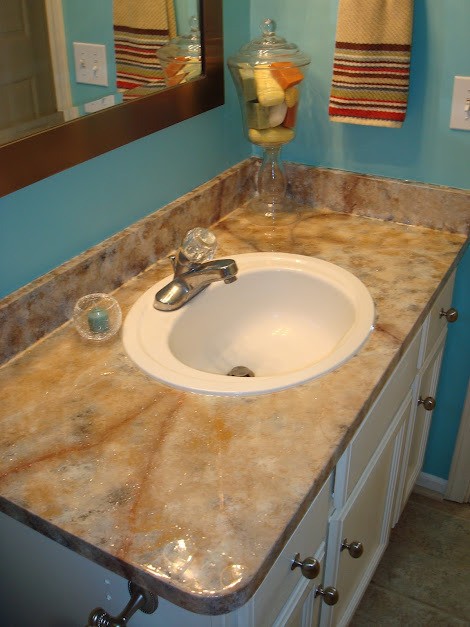
Find the location of a particular element. This screenshot has height=627, width=470. bathroom floor is located at coordinates (427, 545).